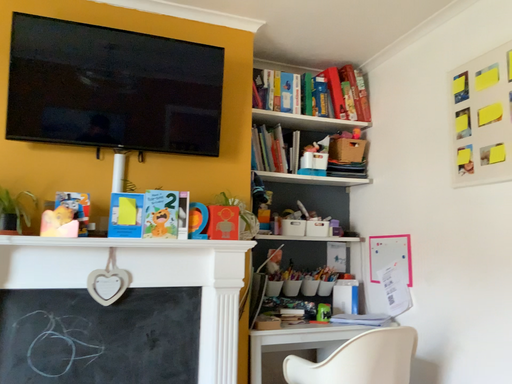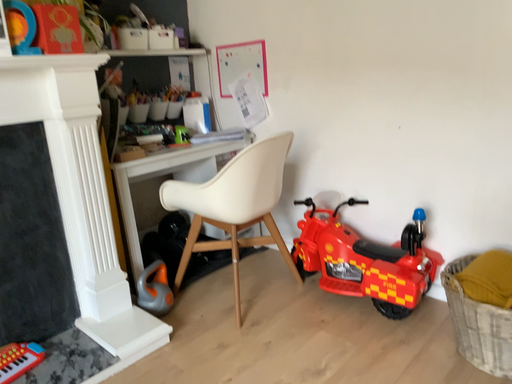
Question: How did the camera likely rotate when shooting the video?

Choices:
 (A) rotated downward
 (B) rotated upward

Answer: (A)